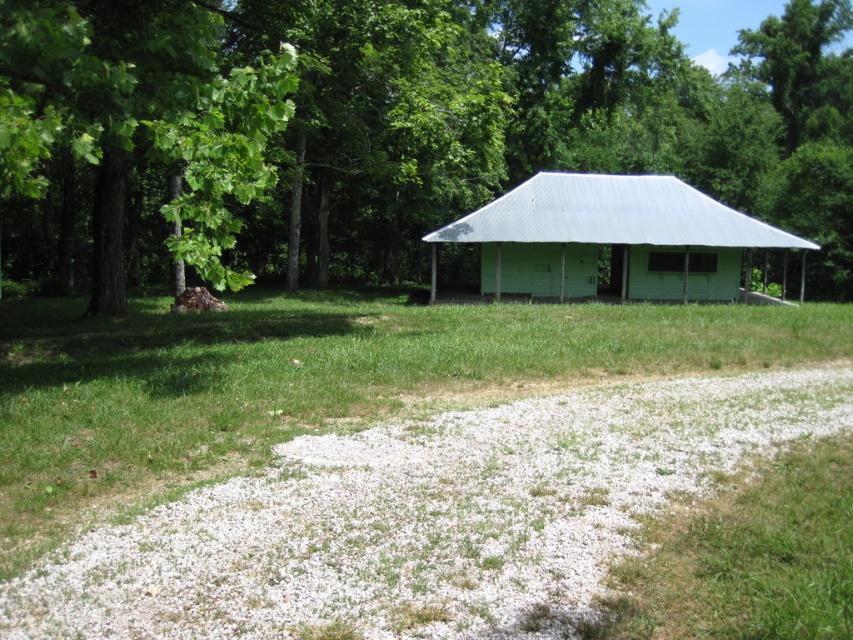
Is green grass at center bigger than green matte/light wood hut at center?

Indeed, green grass at center has a larger size compared to green matte/light wood hut at center.

Is green grass at center positioned at the back of green matte/light wood hut at center?

No, green grass at center is closer to the viewer.

Does point (322, 330) lie behind point (672, 218)?

That is False.

Locate an element on the screen. Image resolution: width=853 pixels, height=640 pixels. green grass at center is located at coordinates (310, 381).

Is green leafy tree at upper left wider than green grass at center?

Indeed, green leafy tree at upper left has a greater width compared to green grass at center.

Can you confirm if green leafy tree at upper left is positioned above green grass at center?

Yes.

Is point (750, 138) closer to viewer compared to point (849, 349)?

No, (750, 138) is further to viewer.

The height and width of the screenshot is (640, 853). Find the location of `green leafy tree at upper left`. green leafy tree at upper left is located at coordinates (432, 124).

Is the position of green leafy tree at upper left more distant than that of green matte/light wood hut at center?

No, it is not.

Can you confirm if green leafy tree at upper left is positioned to the left of green matte/light wood hut at center?

No, green leafy tree at upper left is not to the left of green matte/light wood hut at center.

Which is in front, point (809, 65) or point (643, 225)?

Point (643, 225) is in front.

Find the location of a particular element. green leafy tree at upper left is located at coordinates (432, 124).